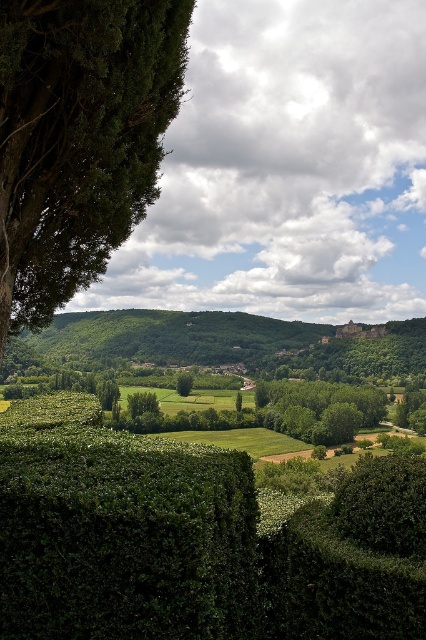
You are standing at the center of the image and want to walk towards the green leafy hedge at center. Which direction should you face to move directly towards it?

Since the green leafy hedge at center is located at point 0.844 on the x axis and 0.455 on the y axis, you should face towards the lower right direction to move directly towards it.

You are a landscape architect designing a garden. You want to place a small statue between the green leafy hedge at center and the green leafy tree at upper left. Which object should the statue be closer to if you want it to be more visible from the garden entrance?

The statue should be closer to the green leafy tree at upper left because it is taller than the green leafy hedge at center, making it a better focal point for visibility from the entrance.